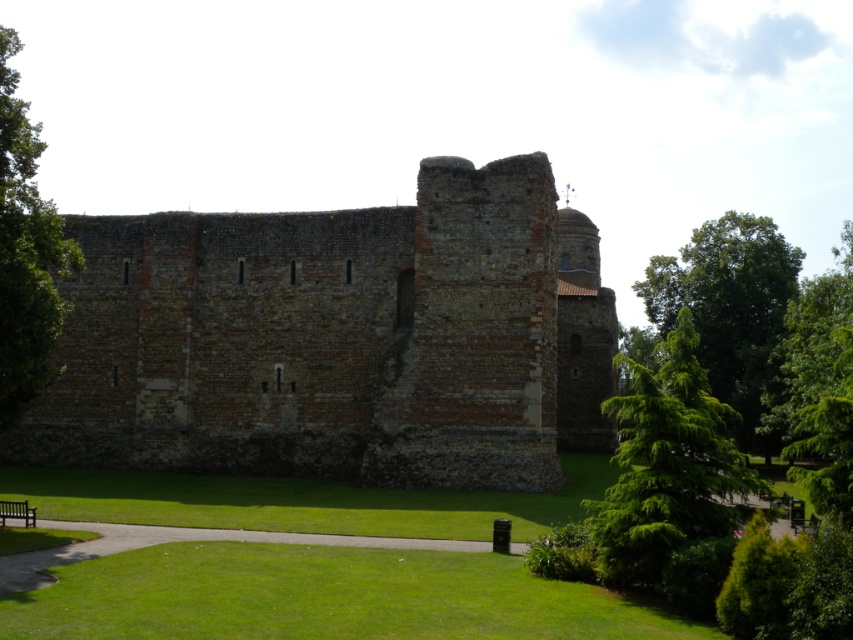
The width and height of the screenshot is (853, 640). What are the coordinates of `brown stone wall at center` in the screenshot? It's located at (339, 339).

Who is lower down, brown stone wall at center or green leafy tree at left?

Positioned lower is brown stone wall at center.

Describe the element at coordinates (339, 339) in the screenshot. I see `brown stone wall at center` at that location.

Where is `brown stone wall at center`? brown stone wall at center is located at coordinates (339, 339).

Is green leafy tree at left below green leafy tree at right?

Actually, green leafy tree at left is above green leafy tree at right.

Does green leafy tree at left appear on the left side of green leafy tree at right?

Correct, you'll find green leafy tree at left to the left of green leafy tree at right.

I want to click on green leafy tree at left, so click(25, 253).

Who is shorter, brown stone wall at center or green needle-like tree at center-right?

With less height is green needle-like tree at center-right.

Is brown stone wall at center further to the viewer compared to green needle-like tree at center-right?

Yes, brown stone wall at center is further from the viewer.

Which is in front, point (415, 330) or point (682, 381)?

Positioned in front is point (682, 381).

Identify the location of brown stone wall at center. (339, 339).